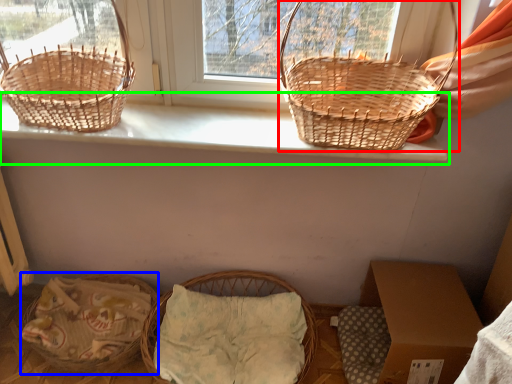
Question: Based on their relative distances, which object is nearer to picnic basket (highlighted by a red box)? Choose from basket (highlighted by a blue box) and window sill (highlighted by a green box).

Choices:
 (A) basket
 (B) window sill

Answer: (B)